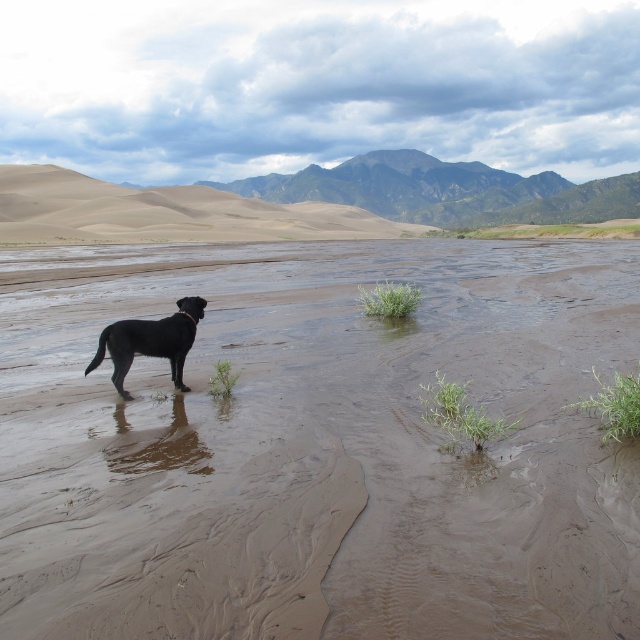
Question: Can you confirm if brown sandy mud at center is bigger than black glossy dog at center?

Choices:
 (A) yes
 (B) no

Answer: (A)

Question: Is brown sandy mud at center to the right of black glossy dog at center from the viewer's perspective?

Choices:
 (A) yes
 (B) no

Answer: (A)

Question: In this image, where is brown sandy mud at center located relative to black glossy dog at center?

Choices:
 (A) left
 (B) right

Answer: (B)

Question: Which point is farther to the camera?

Choices:
 (A) brown sandy mud at center
 (B) black glossy dog at center

Answer: (B)